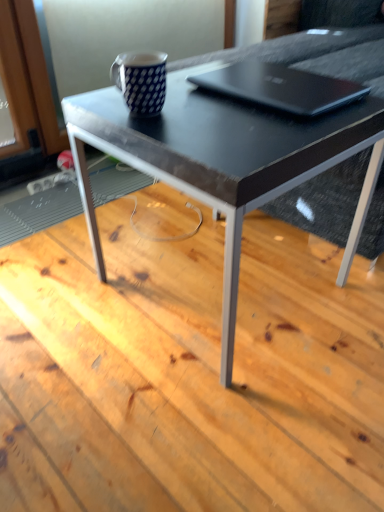
Find the location of a particular element. vacant space that's between blue dotted mug at upper center and black matte laptop at upper center is located at coordinates (221, 112).